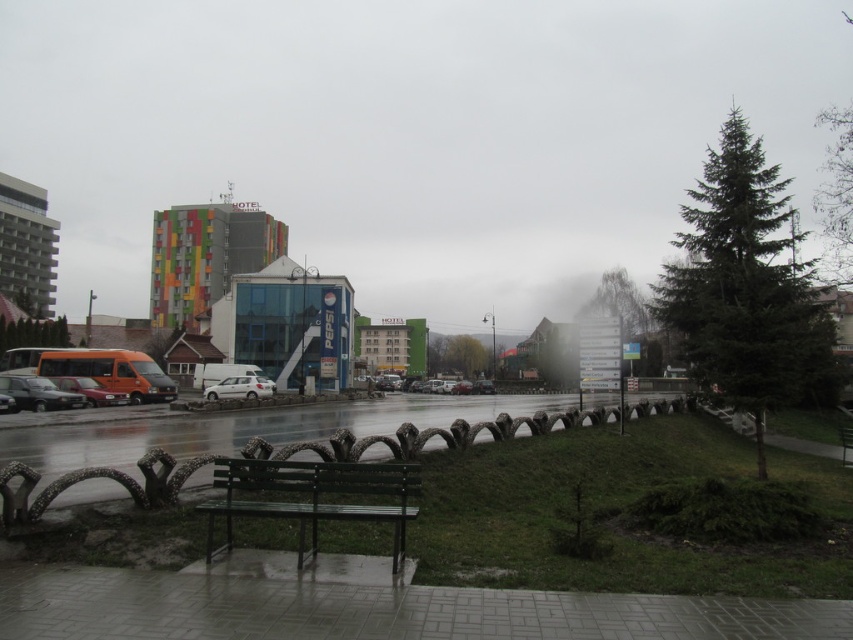
Is shiny silver sedan at lower left bigger than shiny silver car at lower left?

Yes, shiny silver sedan at lower left is bigger than shiny silver car at lower left.

Is shiny silver sedan at lower left positioned before shiny silver car at lower left?

Yes, it is.

Between point (55, 401) and point (91, 403), which one is positioned in front?

Point (55, 401) is more forward.

Locate an element on the screen. The height and width of the screenshot is (640, 853). shiny silver sedan at lower left is located at coordinates (38, 394).

Does shiny silver sedan at lower left appear on the left side of white matte car at center?

Correct, you'll find shiny silver sedan at lower left to the left of white matte car at center.

Who is positioned more to the left, shiny silver sedan at lower left or white matte car at center?

shiny silver sedan at lower left is more to the left.

Is point (15, 380) positioned before point (223, 381)?

That is True.

Image resolution: width=853 pixels, height=640 pixels. I want to click on shiny silver sedan at lower left, so click(38, 394).

Does white matte car at center have a lesser height compared to shiny silver car at lower left?

No, white matte car at center is not shorter than shiny silver car at lower left.

Which is behind, point (247, 387) or point (120, 397)?

Positioned behind is point (247, 387).

Is point (263, 378) farther from viewer compared to point (90, 396)?

Yes, point (263, 378) is farther from viewer.

Locate an element on the screen. The image size is (853, 640). white matte car at center is located at coordinates (241, 387).